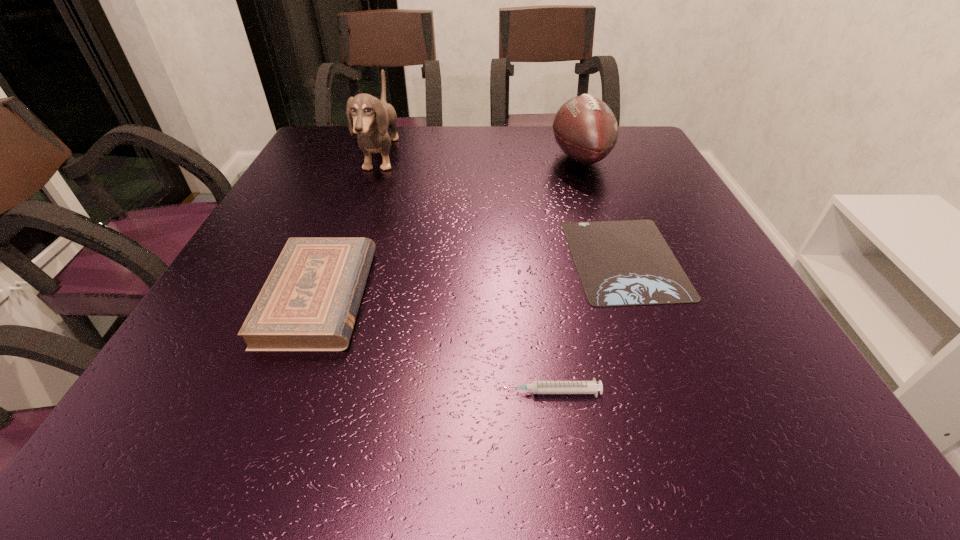
Where is `the tallest object`? the tallest object is located at coordinates (372, 117).

Locate an element on the screen. This screenshot has height=540, width=960. the fourth shortest object is located at coordinates (585, 128).

The height and width of the screenshot is (540, 960). I want to click on Bible, so coord(310,300).

Locate an element on the screen. The width and height of the screenshot is (960, 540). the third object from right to left is located at coordinates (537, 387).

Image resolution: width=960 pixels, height=540 pixels. What are the coordinates of `the fourth tallest object` in the screenshot? It's located at (537, 387).

Image resolution: width=960 pixels, height=540 pixels. Identify the location of mousepad. (620, 263).

Locate an element on the screen. The image size is (960, 540). vacant space located at the face of the puppy is located at coordinates (534, 157).

The height and width of the screenshot is (540, 960). I want to click on free region located on the left of the football (American), so pyautogui.click(x=469, y=158).

The image size is (960, 540). Find the location of `free space located on the spine side of the third tallest object`. free space located on the spine side of the third tallest object is located at coordinates (541, 296).

Where is `vacant area situated 0.080m at the needle end of the fourth tallest object`? vacant area situated 0.080m at the needle end of the fourth tallest object is located at coordinates (444, 392).